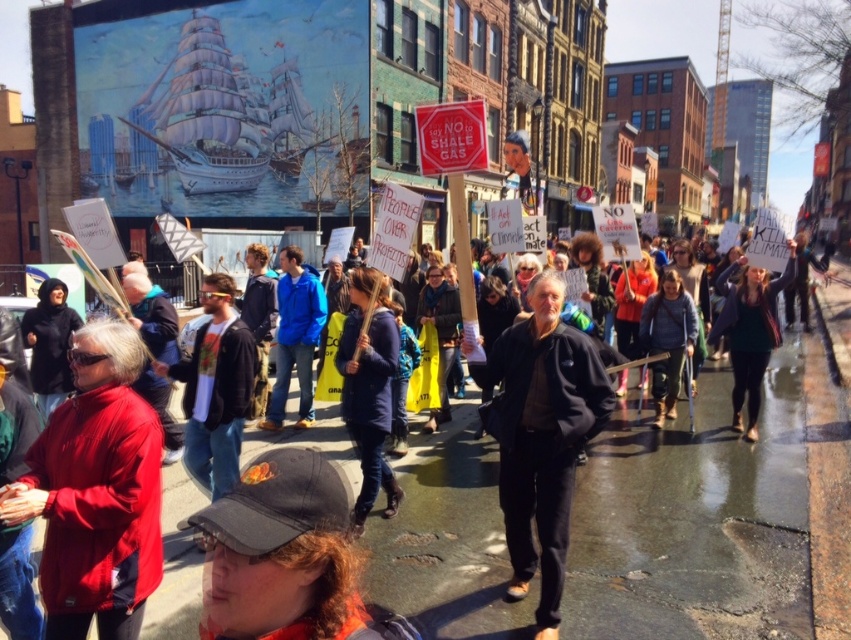
Question: Is blue denim jacket at center further to the viewer compared to dark gray sweater at center?

Choices:
 (A) no
 (B) yes

Answer: (A)

Question: Which of the following is the closest to the observer?

Choices:
 (A) blue denim jacket at center
 (B) black matte jacket at center
 (C) dark gray sweater at center

Answer: (B)

Question: Does black matte jacket at center have a greater width compared to blue denim jacket at center?

Choices:
 (A) no
 (B) yes

Answer: (B)

Question: Is red softshell jacket at lower left bigger than dark gray sweater at center?

Choices:
 (A) no
 (B) yes

Answer: (A)

Question: Which point is closer to the camera?

Choices:
 (A) (490, 356)
 (B) (380, 408)
 (C) (740, 300)
 (D) (86, 604)

Answer: (D)

Question: Which point is closer to the camera taking this photo?

Choices:
 (A) (364, 468)
 (B) (775, 291)

Answer: (A)